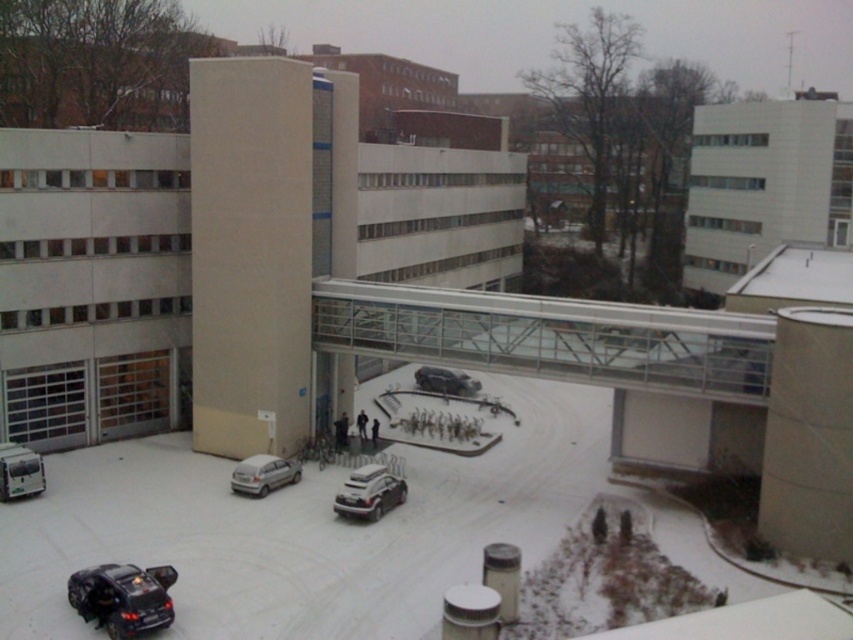
Question: Among these points, which one is farthest from the camera?

Choices:
 (A) (107, 419)
 (B) (405, 497)
 (C) (24, 448)
 (D) (131, 627)

Answer: (A)

Question: Among these points, which one is nearest to the camera?

Choices:
 (A) (468, 385)
 (B) (10, 488)

Answer: (B)

Question: Is satin silver car at center below satin silver car at lower left?

Choices:
 (A) no
 (B) yes

Answer: (B)

Question: Does satin silver car at center have a smaller size compared to white matte van at lower left?

Choices:
 (A) no
 (B) yes

Answer: (B)

Question: Is beige concrete parking garage at center in front of white matte van at lower left?

Choices:
 (A) yes
 (B) no

Answer: (B)

Question: Which object is positioned farthest from the transparent glass bridge at center?

Choices:
 (A) shiny silver sedan at center
 (B) shiny black suv at lower left
 (C) satin silver car at lower left

Answer: (B)